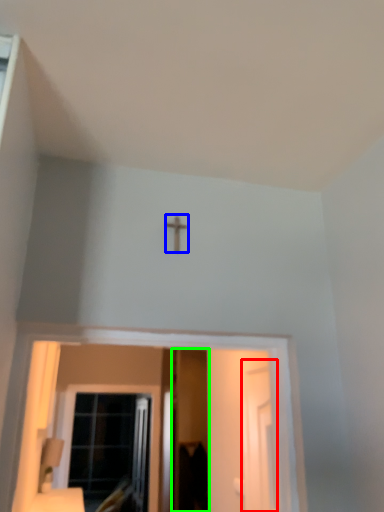
Question: Estimate the real-world distances between objects in this image. Which object is farther from screen door (highlighted by a red box), crucifix (highlighted by a blue box) or screen door (highlighted by a green box)?

Choices:
 (A) crucifix
 (B) screen door

Answer: (B)